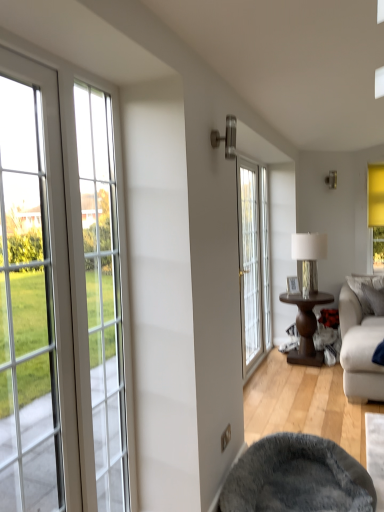
Question: From a real-world perspective, is white glass door at center physically below gray fabric pillow at right?

Choices:
 (A) no
 (B) yes

Answer: (A)

Question: Is the depth of white glass door at center greater than that of gray fabric pillow at right?

Choices:
 (A) yes
 (B) no

Answer: (B)

Question: Would you say white glass door at center is a long distance from gray fabric pillow at right?

Choices:
 (A) no
 (B) yes

Answer: (B)

Question: Does white glass door at center have a smaller size compared to gray fabric pillow at right?

Choices:
 (A) yes
 (B) no

Answer: (B)

Question: Considering the relative positions of white glass door at center and gray fabric pillow at right in the image provided, is white glass door at center to the right of gray fabric pillow at right from the viewer's perspective?

Choices:
 (A) yes
 (B) no

Answer: (B)

Question: Is white glass door at center positioned before gray fabric pillow at right?

Choices:
 (A) no
 (B) yes

Answer: (B)

Question: Is gray plush bean bag chair at lower center positioned with its back to metallic silver lamp at center-right?

Choices:
 (A) no
 (B) yes

Answer: (A)

Question: Would you say metallic silver lamp at center-right is part of gray plush bean bag chair at lower center's contents?

Choices:
 (A) yes
 (B) no

Answer: (B)

Question: Is gray plush bean bag chair at lower center not close to metallic silver lamp at center-right?

Choices:
 (A) no
 (B) yes

Answer: (B)

Question: Is gray plush bean bag chair at lower center taller than metallic silver lamp at center-right?

Choices:
 (A) no
 (B) yes

Answer: (A)

Question: Does gray plush bean bag chair at lower center have a greater width compared to metallic silver lamp at center-right?

Choices:
 (A) yes
 (B) no

Answer: (A)

Question: From the image's perspective, would you say gray plush bean bag chair at lower center is shown under metallic silver lamp at center-right?

Choices:
 (A) yes
 (B) no

Answer: (A)

Question: Can you confirm if gray plush bean bag chair at lower center is thinner than white fabric couch at lower right?

Choices:
 (A) yes
 (B) no

Answer: (A)